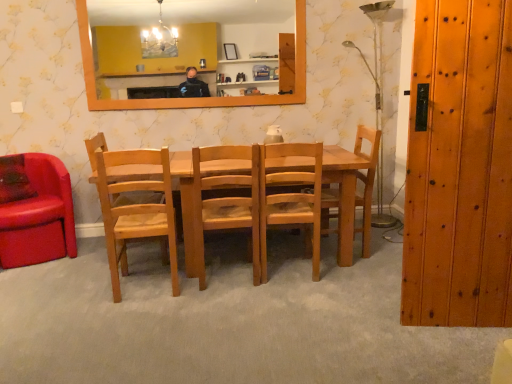
Question: From a real-world perspective, is natural wood chair at left, the 2th chair from the left, physically above orange wooden mirror at upper center?

Choices:
 (A) yes
 (B) no

Answer: (B)

Question: Is natural wood chair at left, which is the 4th chair in right-to-left order, turned away from orange wooden mirror at upper center?

Choices:
 (A) yes
 (B) no

Answer: (B)

Question: Does natural wood chair at left, the 2th chair from the left, have a larger size compared to orange wooden mirror at upper center?

Choices:
 (A) no
 (B) yes

Answer: (B)

Question: Does natural wood chair at left, the 2th chair from the left, have a smaller size compared to orange wooden mirror at upper center?

Choices:
 (A) no
 (B) yes

Answer: (A)

Question: Is natural wood chair at left, which is the 4th chair in right-to-left order, wider than orange wooden mirror at upper center?

Choices:
 (A) yes
 (B) no

Answer: (A)

Question: Is natural wood chair at left, which is the 4th chair in right-to-left order, facing towards orange wooden mirror at upper center?

Choices:
 (A) no
 (B) yes

Answer: (A)

Question: Does wooden door at right lie in front of orange wooden mirror at upper center?

Choices:
 (A) no
 (B) yes

Answer: (B)

Question: Is wooden door at right not near orange wooden mirror at upper center?

Choices:
 (A) no
 (B) yes

Answer: (B)

Question: Can you confirm if wooden door at right is wider than orange wooden mirror at upper center?

Choices:
 (A) yes
 (B) no

Answer: (A)

Question: Is the depth of wooden door at right greater than that of orange wooden mirror at upper center?

Choices:
 (A) yes
 (B) no

Answer: (B)

Question: Can you confirm if wooden door at right is thinner than orange wooden mirror at upper center?

Choices:
 (A) no
 (B) yes

Answer: (A)

Question: Is wooden door at right to the right of orange wooden mirror at upper center from the viewer's perspective?

Choices:
 (A) no
 (B) yes

Answer: (B)

Question: Considering the relative sizes of wooden door at right and leather couch at left, which ranks as the 5th chair in right-to-left order, in the image provided, is wooden door at right thinner than leather couch at left, which ranks as the 5th chair in right-to-left order,?

Choices:
 (A) no
 (B) yes

Answer: (B)